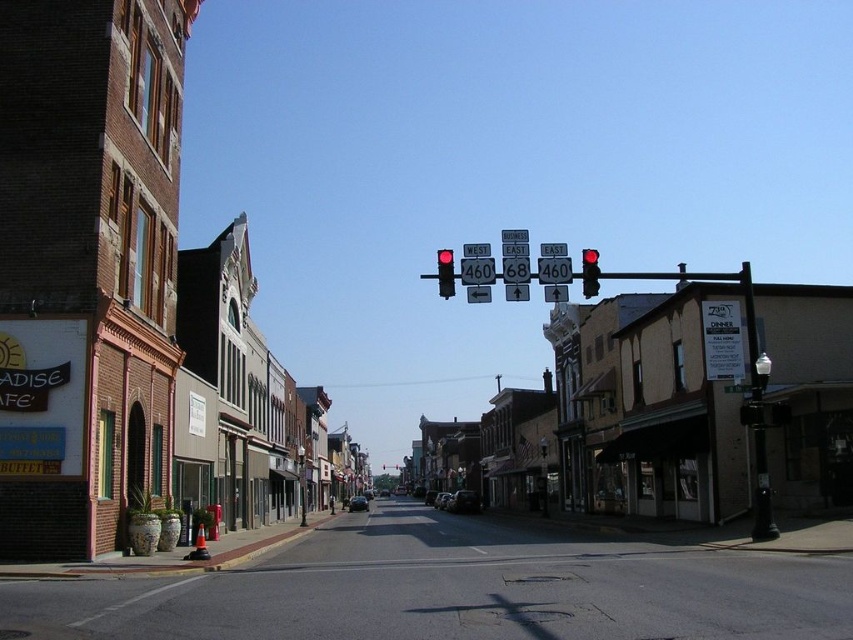
Question: Does smooth asphalt road at center lie in front of matte red traffic light at center?

Choices:
 (A) yes
 (B) no

Answer: (A)

Question: Does smooth asphalt road at center have a greater width compared to red glass traffic light at center?

Choices:
 (A) no
 (B) yes

Answer: (A)

Question: Which of the following is the farthest from the observer?

Choices:
 (A) smooth asphalt road at center
 (B) matte red traffic light at center
 (C) brick building at left
 (D) red glass traffic light at center

Answer: (D)

Question: Which point is farther to the camera?

Choices:
 (A) brick building at left
 (B) red glass traffic light at center
 (C) matte red traffic light at center

Answer: (B)

Question: Does smooth asphalt road at center appear over red glass traffic light at center?

Choices:
 (A) no
 (B) yes

Answer: (A)

Question: Which object is closer to the camera taking this photo?

Choices:
 (A) matte red traffic light at center
 (B) brick building at left
 (C) red glass traffic light at center

Answer: (B)